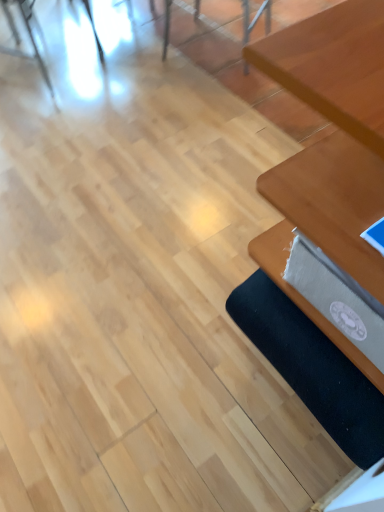
The image size is (384, 512). What are the coordinates of `free space between wooden table at right and metallic silver chair at upper left, which is the second chair from right to left` in the screenshot? It's located at (151, 152).